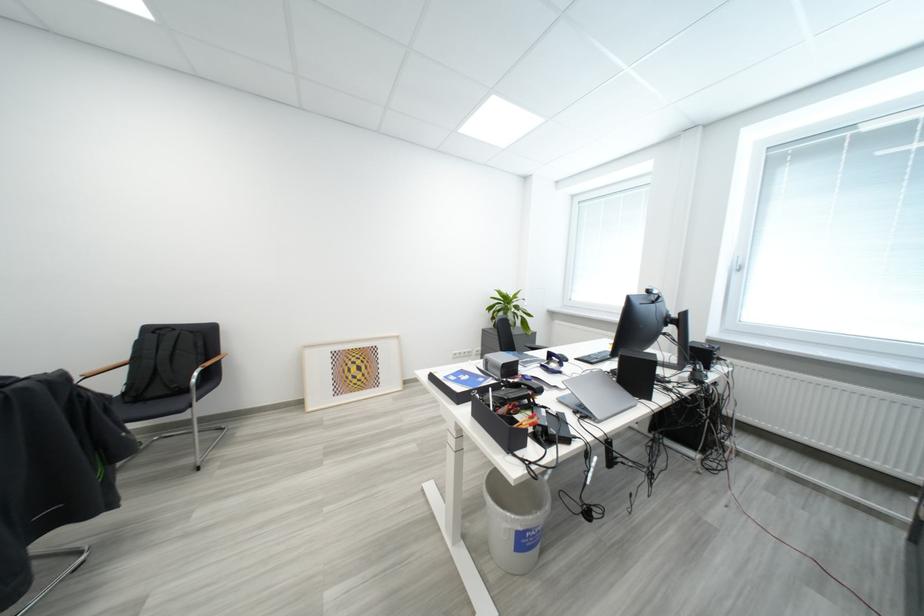
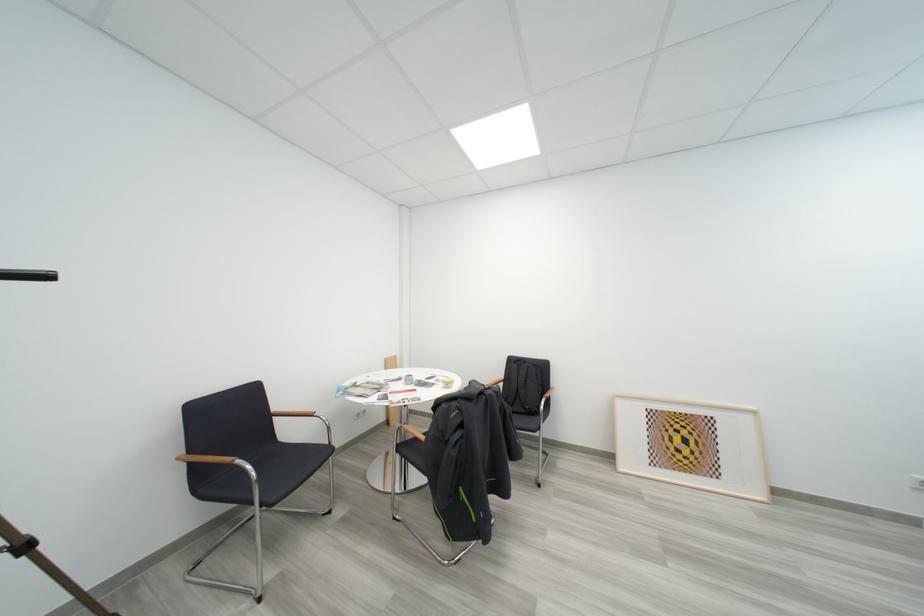
Question: The images are taken continuously from a first-person perspective. In which direction is your viewpoint rotating?

Choices:
 (A) Left
 (B) Right
 (C) Up
 (D) Down

Answer: (A)